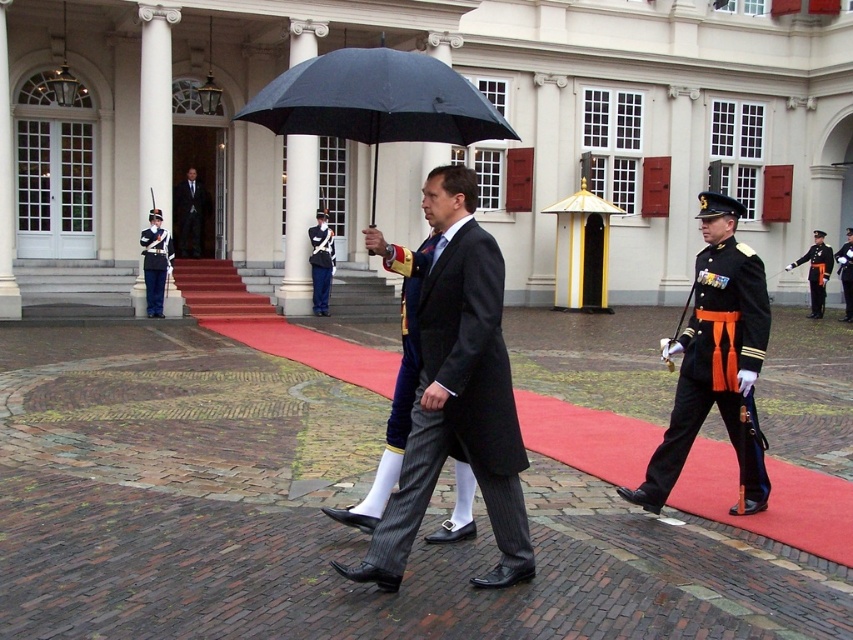
Does shiny silver helmet at left have a greater height compared to orange fabric sash at right?

Incorrect, shiny silver helmet at left's height is not larger of orange fabric sash at right's.

Which is behind, point (161, 276) or point (811, 316)?

Positioned behind is point (811, 316).

Locate an element on the screen. shiny silver helmet at left is located at coordinates pyautogui.click(x=155, y=260).

Does matte black coat at center appear on the right side of uniformed soldier at center?

Correct, you'll find matte black coat at center to the right of uniformed soldier at center.

How far apart are matte black coat at center and uniformed soldier at center?

matte black coat at center is 43.83 feet away from uniformed soldier at center.

The image size is (853, 640). What do you see at coordinates (457, 394) in the screenshot? I see `matte black coat at center` at bounding box center [457, 394].

Locate an element on the screen. This screenshot has height=640, width=853. matte black coat at center is located at coordinates (457, 394).

Between white stone building at center and shiny silver helmet at left, which one has more height?

Standing taller between the two is white stone building at center.

Who is more distant from viewer, (337, 148) or (157, 241)?

The point (337, 148) is more distant.

Between point (16, 84) and point (154, 269), which one is positioned behind?

The point (16, 84) is more distant.

This screenshot has width=853, height=640. In order to click on white stone building at center in this screenshot , I will do `click(421, 141)`.